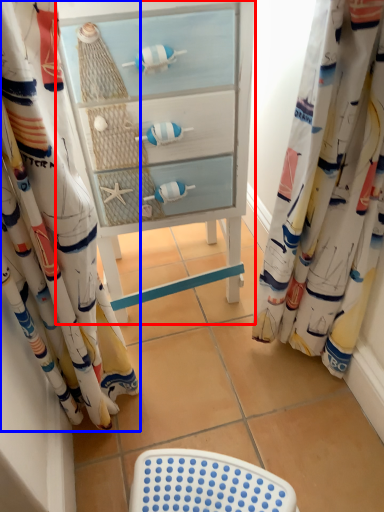
Question: Among these objects, which one is farthest to the camera, furniture (highlighted by a red box) or curtain (highlighted by a blue box)?

Choices:
 (A) furniture
 (B) curtain

Answer: (A)